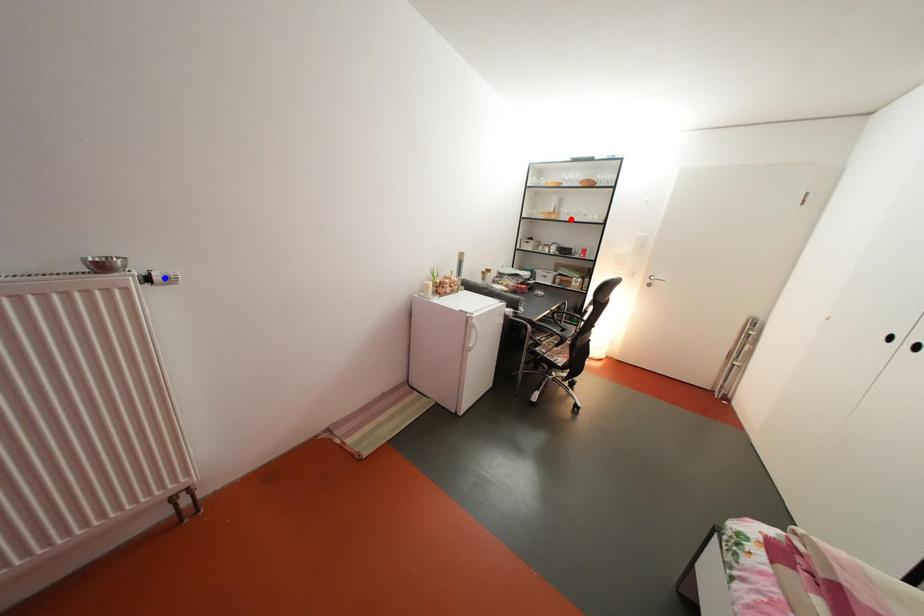
Question: Which of the two points in the image is closer to the camera?

Choices:
 (A) Blue point is closer.
 (B) Red point is closer.

Answer: (A)